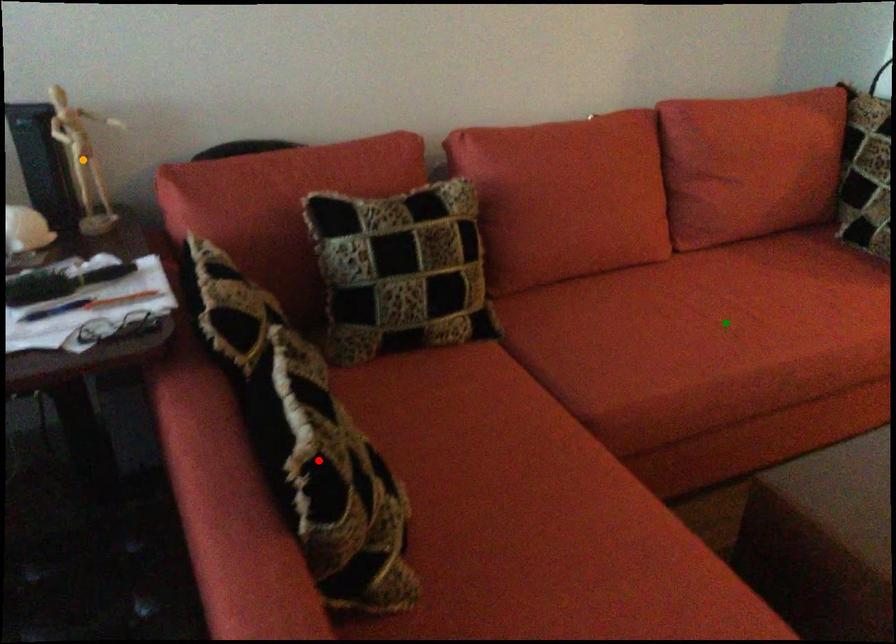
Order these from nearest to farthest:
A) orange point
B) green point
C) red point

red point, orange point, green point